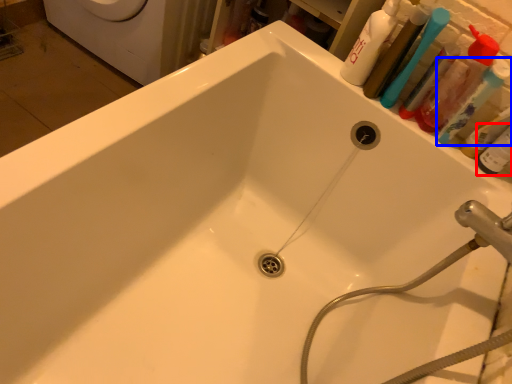
Question: Which point is closer to the camera, toiletry (highlighted by a red box) or toothbrush (highlighted by a blue box)?

Choices:
 (A) toiletry
 (B) toothbrush

Answer: (A)